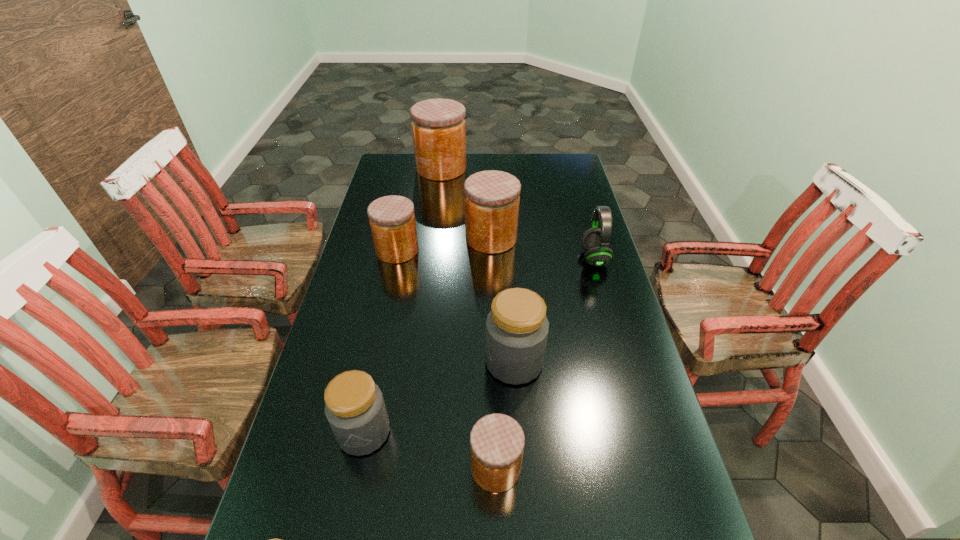
Find the location of `the tallest jar`. the tallest jar is located at coordinates (438, 126).

This screenshot has height=540, width=960. What are the coordinates of `the tallest object` in the screenshot? It's located at (438, 126).

This screenshot has width=960, height=540. Find the location of `the third smallest orange jar`. the third smallest orange jar is located at coordinates (492, 198).

Locate an element on the screen. the fourth nearest object is located at coordinates (517, 328).

Image resolution: width=960 pixels, height=540 pixels. I want to click on the biggest gray jar, so click(x=517, y=328).

The width and height of the screenshot is (960, 540). In order to click on black headset in this screenshot , I will do `click(595, 241)`.

Locate an element on the screen. headset is located at coordinates (595, 241).

You are a GUI agent. You are given a task and a screenshot of the screen. Output one action in this format:
    pyautogui.click(x=<x>, y=<y>)
    Task: Click on the second smallest gray jar
    This screenshot has height=540, width=960.
    Given the screenshot: What is the action you would take?
    pyautogui.click(x=354, y=405)

The height and width of the screenshot is (540, 960). Find the location of `the second smallest orange jar`. the second smallest orange jar is located at coordinates (392, 220).

Locate an element on the screen. Image resolution: width=960 pixels, height=540 pixels. the smallest orange jar is located at coordinates (497, 441).